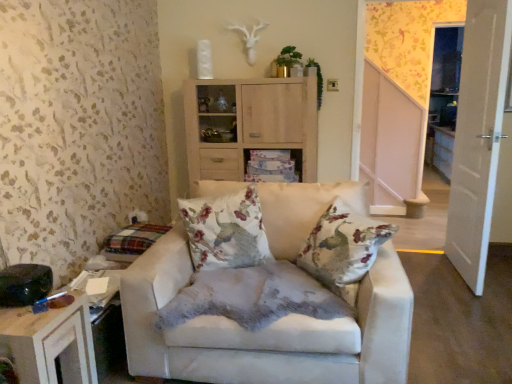
In order to click on floral fabric cushion at center in this screenshot , I will do `click(226, 230)`.

Locate an element on the screen. The width and height of the screenshot is (512, 384). white glossy cabinet at center is located at coordinates (272, 166).

From the image's perspective, between suede beige armchair at center and light wood cabinet at upper center, who is located below?

suede beige armchair at center.

From a real-world perspective, is suede beige armchair at center over light wood cabinet at upper center?

No, from a real-world perspective, suede beige armchair at center is not on top of light wood cabinet at upper center.

You are a GUI agent. You are given a task and a screenshot of the screen. Output one action in this format:
    pyautogui.click(x=<x>, y=<y>)
    Task: Click on the chair that is under the light wood cabinet at upper center (from a real-world perspective)
    Image resolution: width=512 pixels, height=384 pixels.
    Given the screenshot: What is the action you would take?
    pyautogui.click(x=266, y=329)

Do you think light wood cabinet at upper center is within white glossy door at right, or outside of it?

light wood cabinet at upper center is outside white glossy door at right.

Can you tell me how much light wood cabinet at upper center and white glossy door at right differ in facing direction?

The angular difference between light wood cabinet at upper center and white glossy door at right is 89.4 degrees.

Considering the relative sizes of light wood cabinet at upper center and white glossy door at right in the image provided, is light wood cabinet at upper center bigger than white glossy door at right?

Correct, light wood cabinet at upper center is larger in size than white glossy door at right.

Is light wood cabinet at upper center with white glossy door at right?

light wood cabinet at upper center and white glossy door at right are not in contact.

Considering the relative sizes of light wood cabinet at upper center and white glossy cabinet at center in the image provided, is light wood cabinet at upper center wider than white glossy cabinet at center?

Indeed, light wood cabinet at upper center has a greater width compared to white glossy cabinet at center.

Considering the positions of objects light wood cabinet at upper center and white glossy cabinet at center in the image provided, who is more to the right, light wood cabinet at upper center or white glossy cabinet at center?

From the viewer's perspective, white glossy cabinet at center appears more on the right side.

Between light wood cabinet at upper center and white glossy cabinet at center, which one has larger size?

light wood cabinet at upper center.

Does white glossy cabinet at center have a greater width compared to wooden table at lower left?

Incorrect, the width of white glossy cabinet at center does not surpass that of wooden table at lower left.

Is white glossy cabinet at center looking in the opposite direction of wooden table at lower left?

No, wooden table at lower left is not at the back of white glossy cabinet at center.

Which is more to the right, white glossy cabinet at center or wooden table at lower left?

Positioned to the right is white glossy cabinet at center.

The width and height of the screenshot is (512, 384). Find the location of `table below the white glossy cabinet at center (from a real-world perspective)`. table below the white glossy cabinet at center (from a real-world perspective) is located at coordinates (50, 343).

Between white glossy door at right and white glossy cabinet at center, which one has smaller size?

With smaller size is white glossy cabinet at center.

Considering the relative sizes of white glossy door at right and white glossy cabinet at center in the image provided, is white glossy door at right wider than white glossy cabinet at center?

No, white glossy door at right is not wider than white glossy cabinet at center.

Can white glossy cabinet at center be found inside white glossy door at right?

Definitely not — white glossy cabinet at center is not inside white glossy door at right.

Considering the positions of point (262, 259) and point (265, 178), is point (262, 259) closer or farther from the camera than point (265, 178)?

Point (262, 259) is closer to the camera than point (265, 178).

Based on their positions, is floral fabric cushion at center located to the left or right of white glossy cabinet at center?

floral fabric cushion at center is positioned on white glossy cabinet at center's left side.

Which object is closer to the camera taking this photo, floral fabric cushion at center or white glossy cabinet at center?

floral fabric cushion at center.

This screenshot has height=384, width=512. Find the location of `shelf behind the floral fabric cushion at center`. shelf behind the floral fabric cushion at center is located at coordinates (272, 166).

Can you confirm if light wood cabinet at upper center is positioned to the right of suede beige armchair at center?

In fact, light wood cabinet at upper center is to the left of suede beige armchair at center.

Is light wood cabinet at upper center situated inside suede beige armchair at center or outside?

light wood cabinet at upper center lies outside suede beige armchair at center.

Is light wood cabinet at upper center far from suede beige armchair at center?

Indeed, light wood cabinet at upper center is not near suede beige armchair at center.

The height and width of the screenshot is (384, 512). Find the location of `chair below the light wood cabinet at upper center (from the image's perspective)`. chair below the light wood cabinet at upper center (from the image's perspective) is located at coordinates (266, 329).

Identify the location of cabinetry on the left of white glossy door at right. The width and height of the screenshot is (512, 384). (249, 124).

From the image, which object appears to be nearer to white glossy door at right, light wood cabinet at upper center or wooden table at lower left?

light wood cabinet at upper center is positioned closer to the anchor white glossy door at right.

When comparing their distances from floral fabric cushion at center, does suede beige armchair at center or wooden table at lower left seem closer?

suede beige armchair at center is positioned closer to the anchor floral fabric cushion at center.

When comparing their distances from suede beige armchair at center, does white glossy cabinet at center or wooden table at lower left seem further?

white glossy cabinet at center is positioned further to the anchor suede beige armchair at center.

Which object lies nearer to the anchor point floral fabric cushion at center, white glossy cabinet at center or light wood cabinet at upper center?

white glossy cabinet at center lies closer to floral fabric cushion at center than the other object.

Estimate the real-world distances between objects in this image. Which object is closer to white glossy door at right, floral fabric cushion at center or white glossy cabinet at center?

white glossy cabinet at center.

Which object lies further to the anchor point wooden table at lower left, white glossy door at right or suede beige armchair at center?

white glossy door at right is positioned further to the anchor wooden table at lower left.

From the image, which object appears to be farther from suede beige armchair at center, white glossy door at right or floral fabric cushion at center?

white glossy door at right is further to suede beige armchair at center.

Considering their positions, is floral fabric cushion at center positioned closer to light wood cabinet at upper center than white glossy door at right?

The object closer to light wood cabinet at upper center is floral fabric cushion at center.

I want to click on pillow between wooden table at lower left and light wood cabinet at upper center in the front-back direction, so click(226, 230).

Locate an element on the screen. The width and height of the screenshot is (512, 384). chair between wooden table at lower left and white glossy door at right in the horizontal direction is located at coordinates (266, 329).

Find the location of a particular element. The width and height of the screenshot is (512, 384). shelf between light wood cabinet at upper center and white glossy door at right from left to right is located at coordinates (272, 166).

The height and width of the screenshot is (384, 512). Find the location of `pillow between suede beige armchair at center and light wood cabinet at upper center from front to back`. pillow between suede beige armchair at center and light wood cabinet at upper center from front to back is located at coordinates (226, 230).